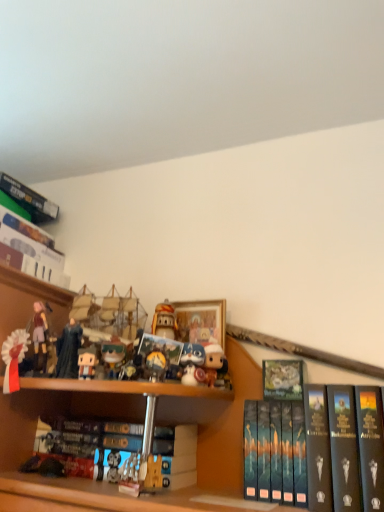
Question: Which direction should I rotate to face white plush toy at center, which ranks as the 1th toy in right-to-left order, — up or down?

Choices:
 (A) down
 (B) up

Answer: (A)

Question: Which direction should I rotate to look at hardcover book at center, which is counted as the 3th book, starting from the right, — up or down?

Choices:
 (A) down
 (B) up

Answer: (A)

Question: Is wooden framed picture at center at the left side of white fabric ribbon at upper left, which is the 1th toy from left to right?

Choices:
 (A) no
 (B) yes

Answer: (A)

Question: Can you confirm if wooden framed picture at center is shorter than white fabric ribbon at upper left, which is the 1th toy from left to right?

Choices:
 (A) no
 (B) yes

Answer: (B)

Question: Does wooden framed picture at center have a smaller size compared to white fabric ribbon at upper left, which is the 1th toy from left to right?

Choices:
 (A) yes
 (B) no

Answer: (B)

Question: Could you tell me if wooden framed picture at center is turned towards white fabric ribbon at upper left, which is the 1th toy from left to right?

Choices:
 (A) no
 (B) yes

Answer: (A)

Question: Is wooden framed picture at center at the right side of white fabric ribbon at upper left, which is the 1th toy from left to right?

Choices:
 (A) no
 (B) yes

Answer: (B)

Question: Considering the relative sizes of wooden framed picture at center and white fabric ribbon at upper left, the 6th toy in the right-to-left sequence, in the image provided, is wooden framed picture at center wider than white fabric ribbon at upper left, the 6th toy in the right-to-left sequence,?

Choices:
 (A) no
 (B) yes

Answer: (B)

Question: Can you confirm if hardcover book at center, which is counted as the 3th book, starting from the right, is shorter than white fabric ribbon at upper left, the 6th toy in the right-to-left sequence?

Choices:
 (A) no
 (B) yes

Answer: (B)

Question: Is hardcover book at center, arranged as the 1th book when viewed from the left, to the left of white fabric ribbon at upper left, which is the 1th toy from left to right, from the viewer's perspective?

Choices:
 (A) no
 (B) yes

Answer: (A)

Question: Does hardcover book at center, which is counted as the 3th book, starting from the right, have a greater height compared to white fabric ribbon at upper left, the 6th toy in the right-to-left sequence?

Choices:
 (A) no
 (B) yes

Answer: (A)

Question: Is hardcover book at center, which is counted as the 3th book, starting from the right, positioned with its back to white fabric ribbon at upper left, the 6th toy in the right-to-left sequence?

Choices:
 (A) no
 (B) yes

Answer: (A)

Question: Is hardcover book at center, arranged as the 1th book when viewed from the left, aimed at white fabric ribbon at upper left, the 6th toy in the right-to-left sequence?

Choices:
 (A) yes
 (B) no

Answer: (B)

Question: Is hardcover book at center, arranged as the 1th book when viewed from the left, positioned in front of white fabric ribbon at upper left, the 6th toy in the right-to-left sequence?

Choices:
 (A) no
 (B) yes

Answer: (B)

Question: Is hardcover book at upper center, the second book positioned from the right, bigger than hardcover book at center, which is counted as the 3th book, starting from the right?

Choices:
 (A) yes
 (B) no

Answer: (B)